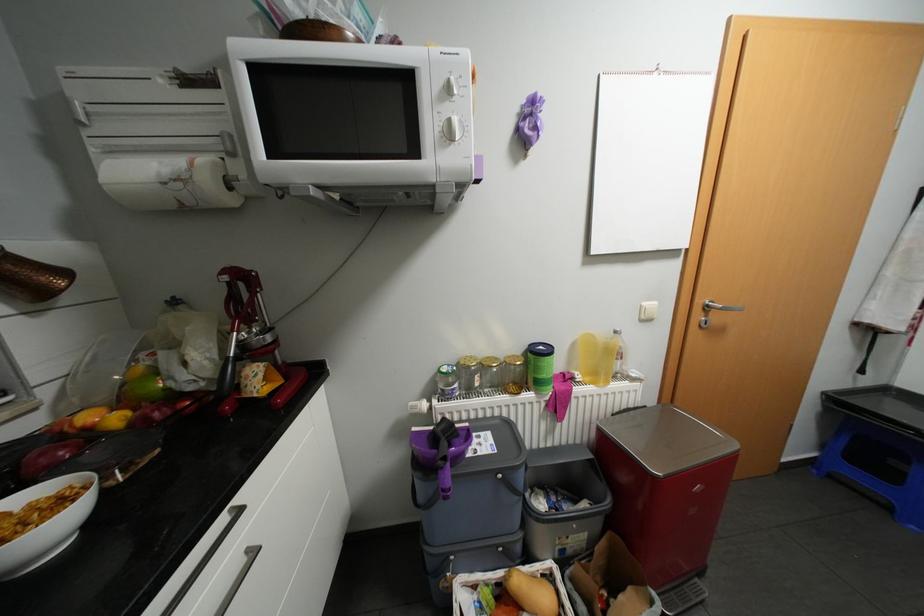
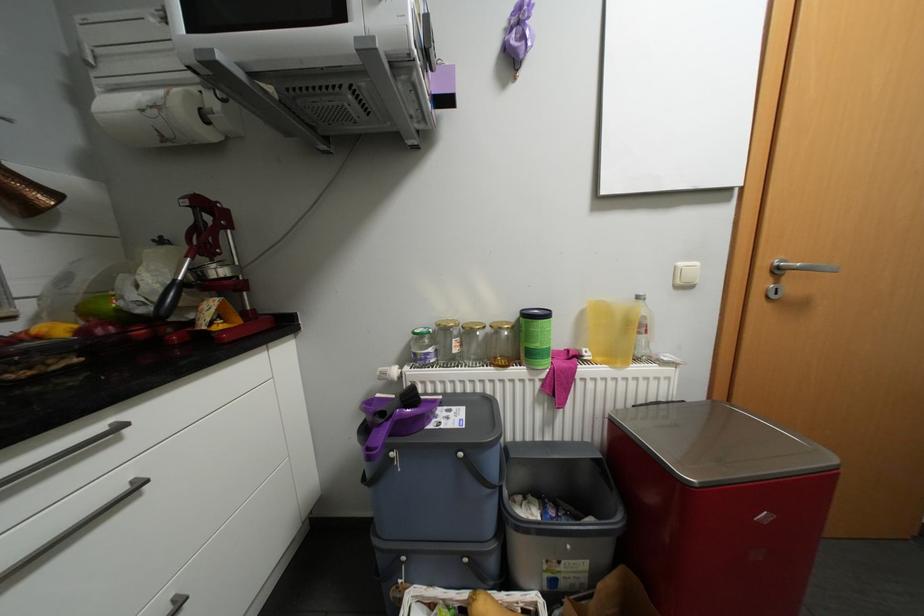
Question: Based on the continuous images, in which direction is the camera rotating? Reply with the corresponding letter.

Choices:
 (A) Left
 (B) Right
 (C) Up
 (D) Down

Answer: (A)